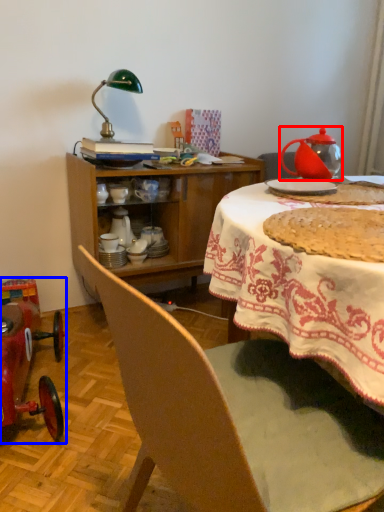
Question: Among these objects, which one is nearest to the camera, kettle (highlighted by a red box) or model car (highlighted by a blue box)?

Choices:
 (A) kettle
 (B) model car

Answer: (B)